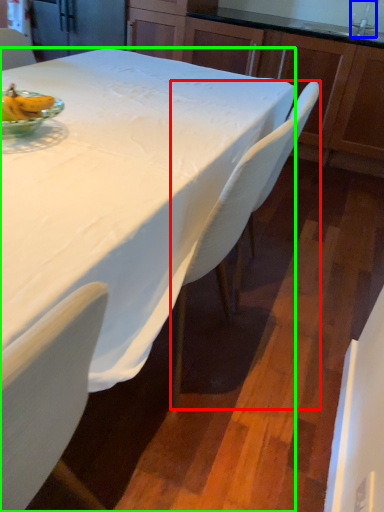
Question: Estimate the real-world distances between objects in this image. Which object is farther from chair (highlighted by a red box), faucet (highlighted by a blue box) or desk (highlighted by a green box)?

Choices:
 (A) faucet
 (B) desk

Answer: (A)